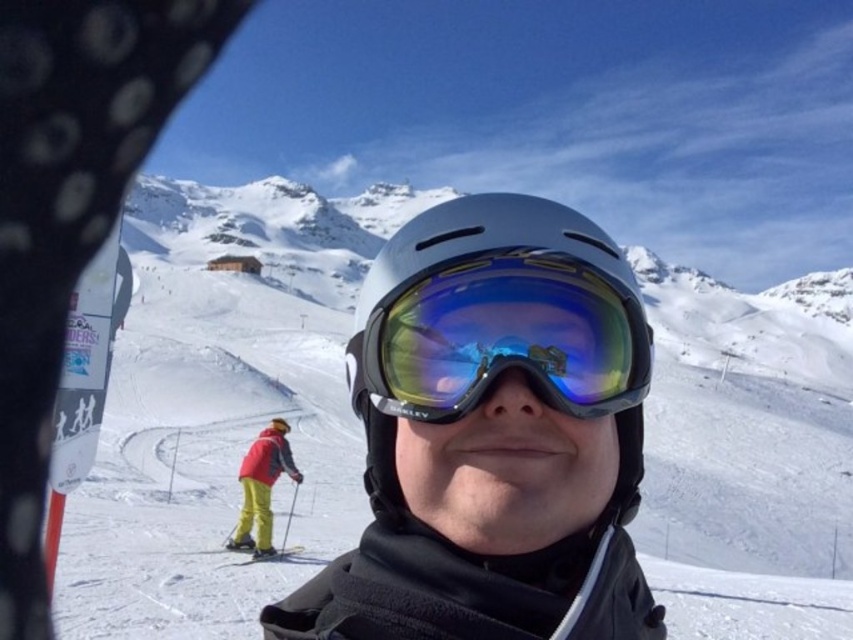
Question: Does matte gray helmet at center lie behind yellow matte ski at lower center?

Choices:
 (A) no
 (B) yes

Answer: (A)

Question: Observing the image, what is the correct spatial positioning of matte gray helmet at center in reference to shiny reflective ski goggles at center?

Choices:
 (A) right
 (B) left

Answer: (A)

Question: Does white matte snow at center have a lesser width compared to yellow matte ski at lower center?

Choices:
 (A) no
 (B) yes

Answer: (A)

Question: Which object appears closest to the camera in this image?

Choices:
 (A) yellow matte ski at lower center
 (B) shiny reflective ski goggles at center

Answer: (B)

Question: Considering the real-world distances, which object is closest to the white matte snow at center?

Choices:
 (A) yellow matte ski at lower center
 (B) matte gray helmet at center
 (C) shiny reflective ski goggles at center

Answer: (B)

Question: Which object appears farthest from the camera in this image?

Choices:
 (A) white matte snow at center
 (B) matte gray helmet at center
 (C) yellow matte ski at lower center

Answer: (C)